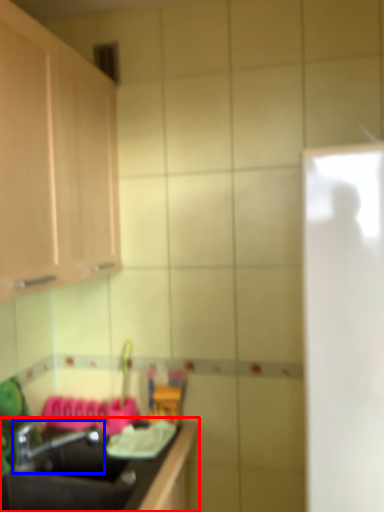
Question: Which object appears closest to the camera in this image, countertop (highlighted by a red box) or tap (highlighted by a blue box)?

Choices:
 (A) countertop
 (B) tap

Answer: (A)